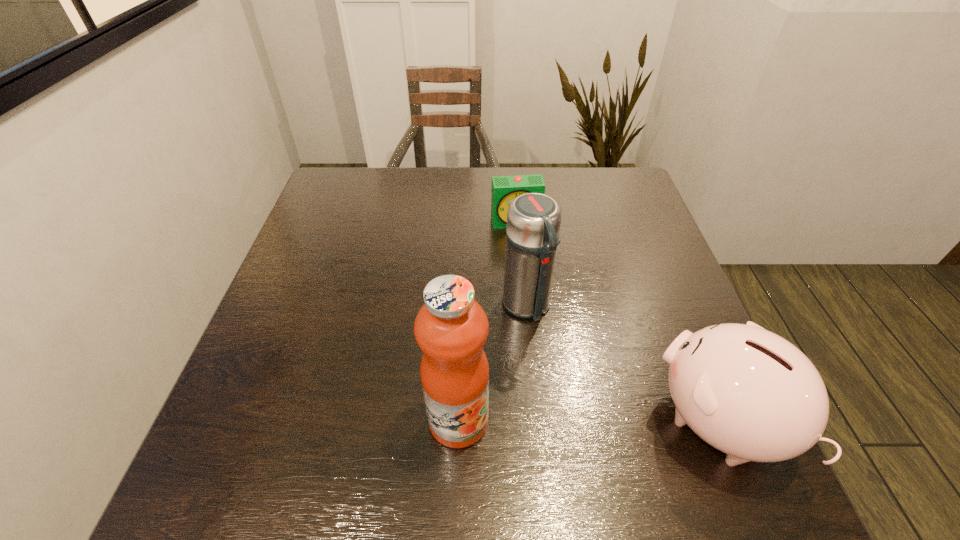
Locate an element on the screen. the leftmost object is located at coordinates (451, 328).

At what (x,y) coordinates should I click in order to perform the action: click on fruit juice. Please return your answer as a coordinate pair (x, y). The height and width of the screenshot is (540, 960). Looking at the image, I should click on (451, 328).

Locate an element on the screen. The width and height of the screenshot is (960, 540). the rightmost object is located at coordinates (748, 392).

Identify the location of piggy bank. (748, 392).

You are a GUI agent. You are given a task and a screenshot of the screen. Output one action in this format:
    pyautogui.click(x=<x>, y=<y>)
    Task: Click on the shortest object
    This screenshot has width=960, height=540.
    Given the screenshot: What is the action you would take?
    pyautogui.click(x=504, y=189)

The height and width of the screenshot is (540, 960). I want to click on alarm clock, so (x=504, y=189).

The image size is (960, 540). In order to click on the second tallest object in this screenshot , I will do `click(533, 220)`.

Identify the location of the second farthest object. The width and height of the screenshot is (960, 540). (533, 220).

You are a GUI agent. You are given a task and a screenshot of the screen. Output one action in this format:
    pyautogui.click(x=<x>, y=<y>)
    Task: Click on the vacant space located on the left of the second shortest object
    The width and height of the screenshot is (960, 540).
    Given the screenshot: What is the action you would take?
    pyautogui.click(x=569, y=421)

Find the location of `vacant space located on the front-facing side of the shortest object`. vacant space located on the front-facing side of the shortest object is located at coordinates (534, 291).